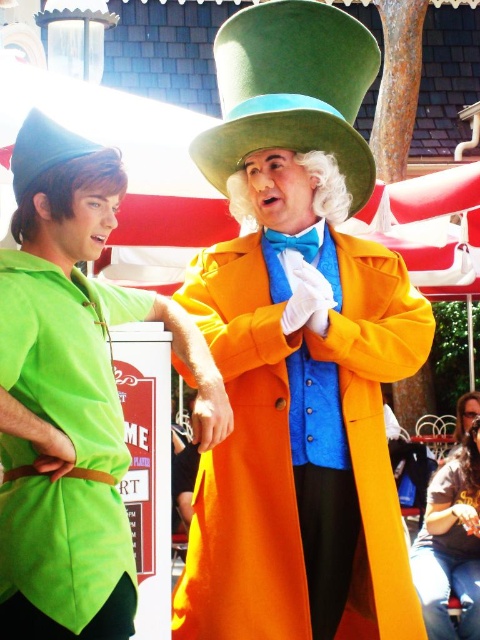
You are a photographer at a costume party and need to capture both the green felt dress hat at center and the green felt dress hat at left in a single shot. Which hat should you focus on to ensure both are in frame?

The green felt dress hat at center is above the green felt dress hat at left, so focusing on the center hat will allow both to be captured in the frame.

You are a costume designer who needs to choose between two green felt dress hats for a performance. The hats are the green felt dress hat at center and the green felt dress hat at left. Which hat should you pick if you want the one that is bigger?

The green felt dress hat at center is larger in size than the green felt dress hat at left, so you should choose the green felt dress hat at center for the bigger option.